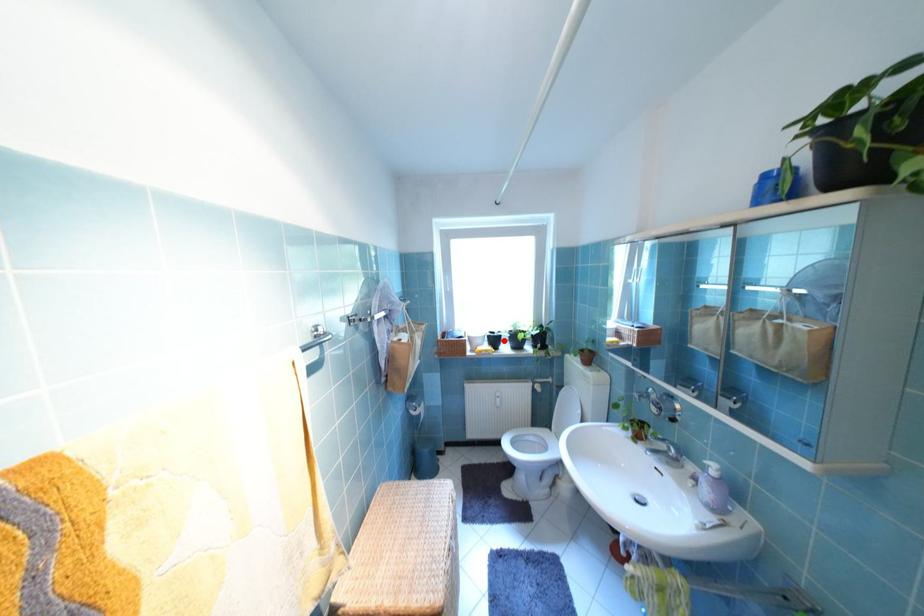
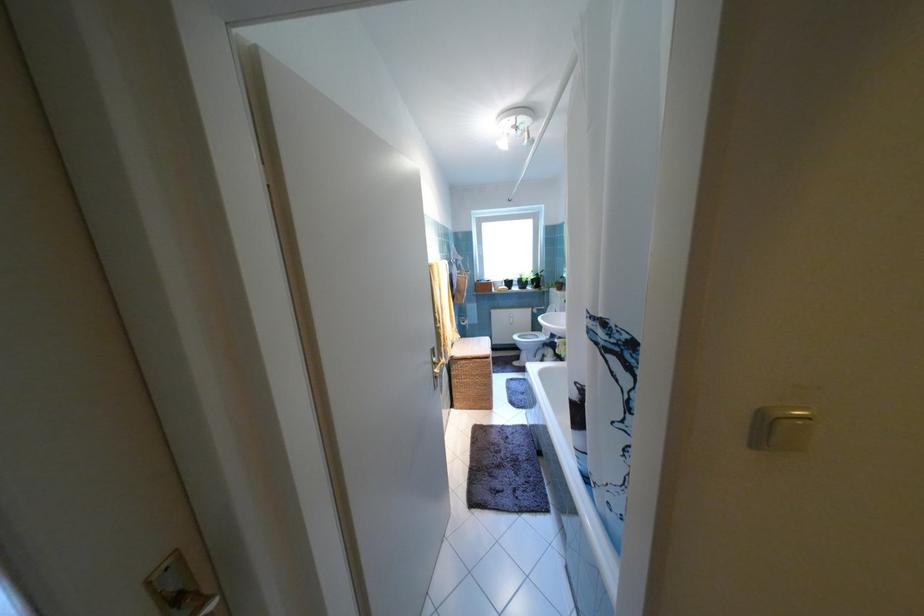
Find the pixel in the second image that matches the highlighted location in the first image.

(517, 284)